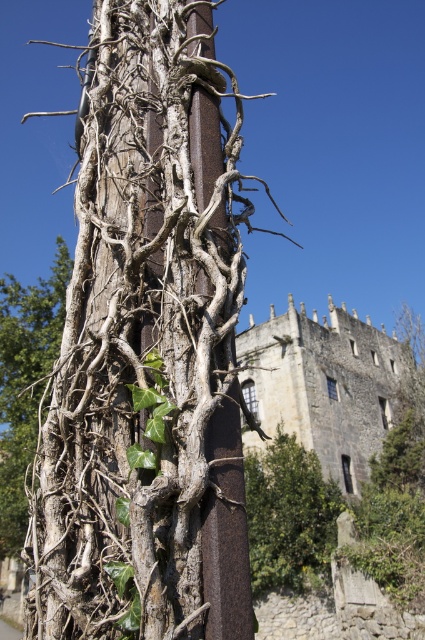
Question: Which object is closer to the camera taking this photo?

Choices:
 (A) dry wood vine at left
 (B) green leafy tree at center

Answer: (A)

Question: Does rusty wood tree trunk at left appear on the left side of dry wood vine at left?

Choices:
 (A) no
 (B) yes

Answer: (A)

Question: Which object is farther from the camera taking this photo?

Choices:
 (A) dry wood vine at left
 (B) green leafy tree at center

Answer: (B)

Question: Which of these objects is positioned closest to the rusty wood tree trunk at left?

Choices:
 (A) green leafy tree at center
 (B) dry wood vine at left

Answer: (B)

Question: Can you confirm if rusty wood tree trunk at left is positioned to the left of green leafy tree at center?

Choices:
 (A) yes
 (B) no

Answer: (A)

Question: Is rusty wood tree trunk at left wider than dry wood vine at left?

Choices:
 (A) no
 (B) yes

Answer: (A)